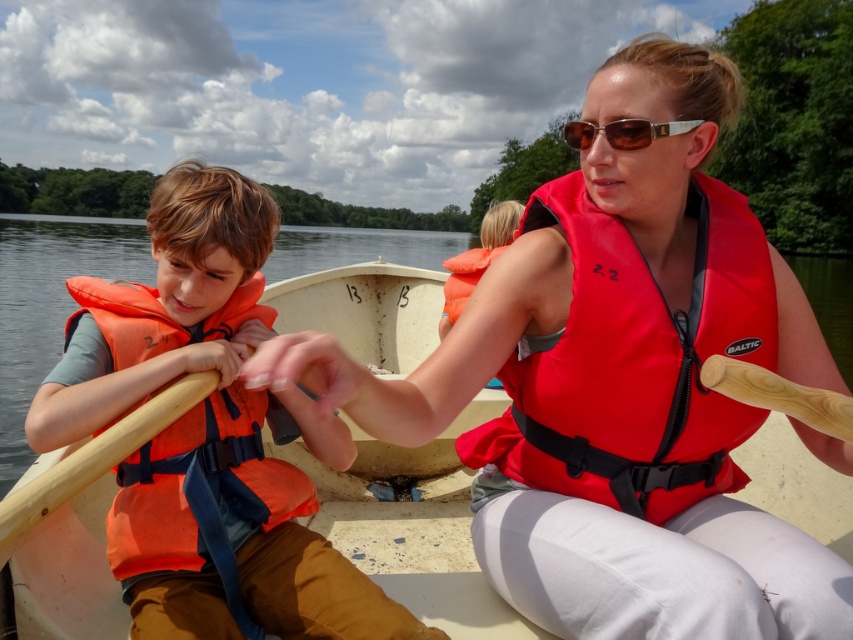
Is matte red life vest at center positioned in front of orange fabric life jacket at left?

That is True.

Measure the distance between matte red life vest at center and orange fabric life jacket at left.

A distance of 23.43 inches exists between matte red life vest at center and orange fabric life jacket at left.

This screenshot has width=853, height=640. I want to click on matte red life vest at center, so click(x=619, y=385).

Is orange life vest at left wider than brown metallic sunglasses at center?

No, orange life vest at left is not wider than brown metallic sunglasses at center.

The height and width of the screenshot is (640, 853). Describe the element at coordinates (207, 435) in the screenshot. I see `orange life vest at left` at that location.

Identify the location of orange life vest at left. (207, 435).

Which is more to the right, red nylon life jacket at center or brown metallic sunglasses at center?

Answer: From the viewer's perspective, brown metallic sunglasses at center appears more on the right side.

Between red nylon life jacket at center and brown metallic sunglasses at center, which one appears on the left side from the viewer's perspective?

From the viewer's perspective, red nylon life jacket at center appears more on the left side.

Between point (711, 461) and point (647, 129), which one is positioned behind?

Positioned behind is point (711, 461).

This screenshot has width=853, height=640. Identify the location of red nylon life jacket at center. (635, 362).